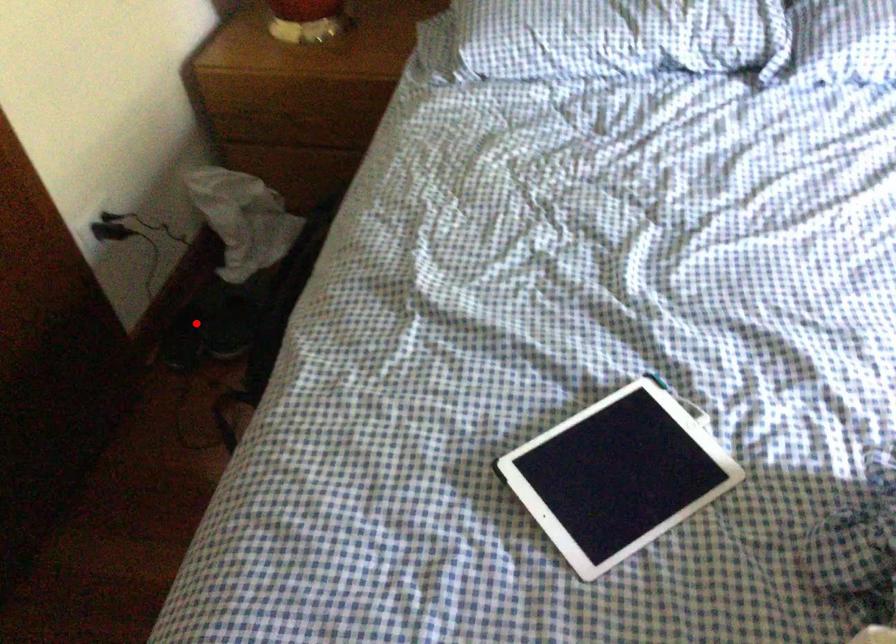
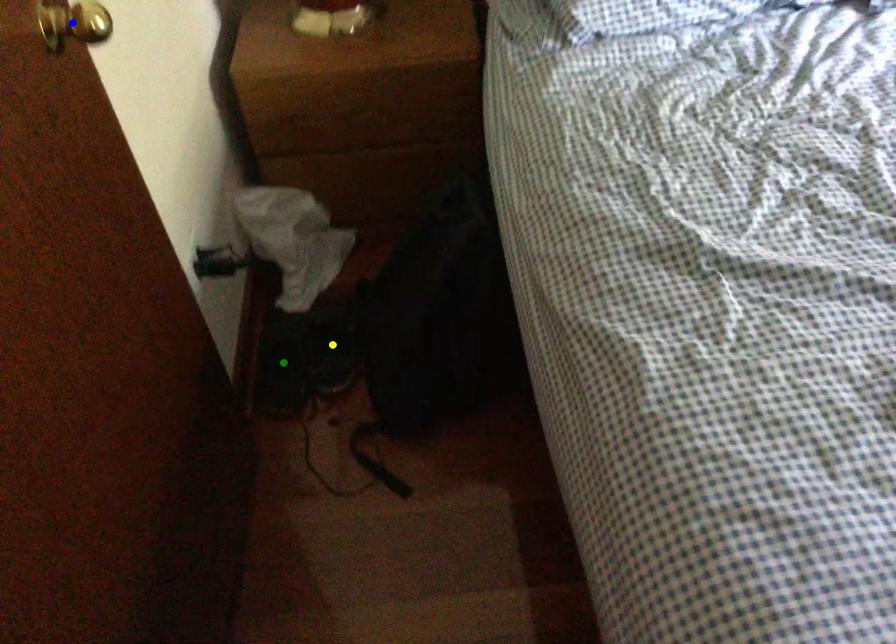
Question: I am providing you with two images of the same scene from different viewpoints. A red point is marked on the first image. You are given multiple points on the second image. In image 2, which mark is for the same physical point as the one in image 1?

Choices:
 (A) green point
 (B) blue point
 (C) yellow point

Answer: (A)